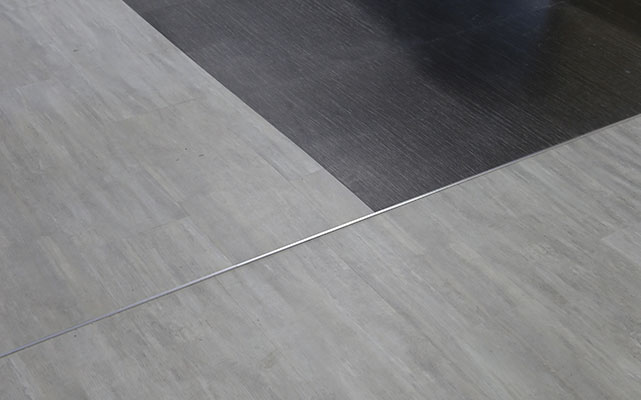
This screenshot has height=400, width=641. In order to click on metal line in floor in this screenshot , I will do `click(361, 217)`.